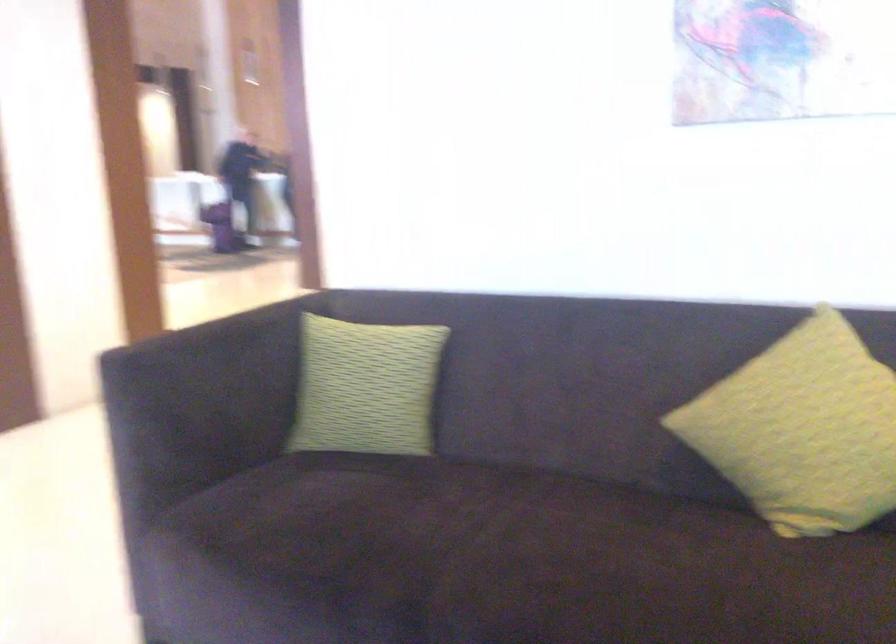
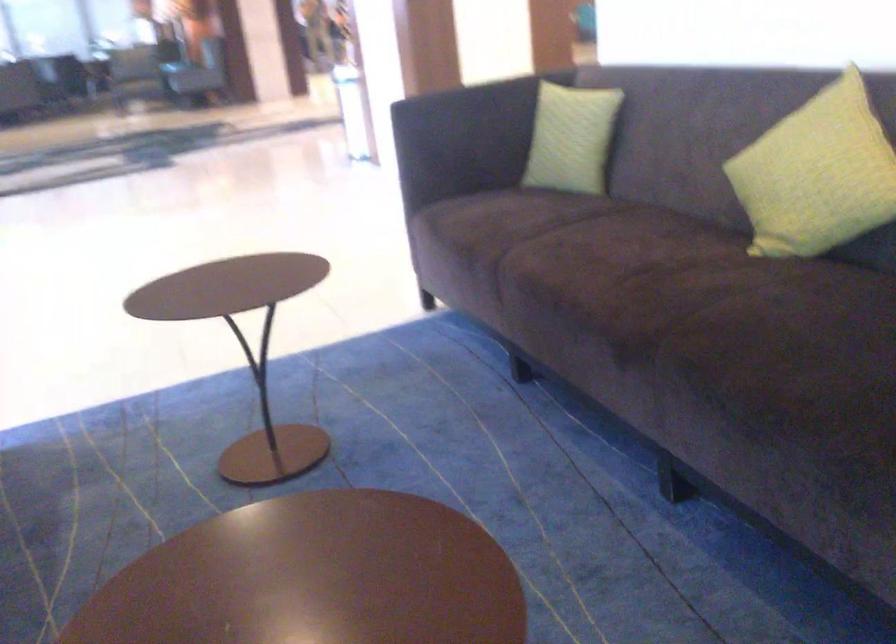
In the second image, find the point that corresponds to pixel 378 391 in the first image.

(571, 138)